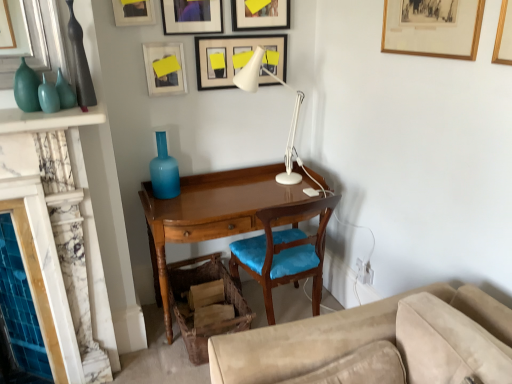
Question: Is wooden swivel chair at lower center aimed at wooden framed picture at upper right, the first picture frame viewed from the right?

Choices:
 (A) no
 (B) yes

Answer: (A)

Question: Does wooden swivel chair at lower center come in front of wooden framed picture at upper right, positioned as the 6th picture frame in left-to-right order?

Choices:
 (A) yes
 (B) no

Answer: (B)

Question: Does wooden swivel chair at lower center appear on the left side of wooden framed picture at upper right, positioned as the 6th picture frame in left-to-right order?

Choices:
 (A) no
 (B) yes

Answer: (B)

Question: Are wooden swivel chair at lower center and wooden framed picture at upper right, positioned as the 6th picture frame in left-to-right order, beside each other?

Choices:
 (A) no
 (B) yes

Answer: (A)

Question: Considering the relative sizes of wooden swivel chair at lower center and wooden framed picture at upper right, positioned as the 6th picture frame in left-to-right order, in the image provided, is wooden swivel chair at lower center bigger than wooden framed picture at upper right, positioned as the 6th picture frame in left-to-right order,?

Choices:
 (A) yes
 (B) no

Answer: (A)

Question: Visually, is matte black picture frame at upper center, which is the fourth picture frame in right-to-left order, positioned to the left or to the right of matte blue glass vase at center, arranged as the first glass vase when viewed from the right?

Choices:
 (A) left
 (B) right

Answer: (B)

Question: From a real-world perspective, is matte black picture frame at upper center, the 3th picture frame positioned from the left, physically located above or below matte blue glass vase at center, arranged as the first glass vase when viewed from the right?

Choices:
 (A) below
 (B) above

Answer: (B)

Question: Based on their sizes in the image, would you say matte black picture frame at upper center, the 3th picture frame positioned from the left, is bigger or smaller than matte blue glass vase at center, arranged as the first glass vase when viewed from the right?

Choices:
 (A) small
 (B) big

Answer: (A)

Question: Relative to matte blue glass vase at center, which is the third glass vase in left-to-right order, is matte black picture frame at upper center, which is the fourth picture frame in right-to-left order, in front or behind?

Choices:
 (A) front
 (B) behind

Answer: (A)

Question: From the image's perspective, is white matte picture frame at upper center, marked as the 2th picture frame in a left-to-right arrangement, above or below wooden chair with blue cushion at center?

Choices:
 (A) below
 (B) above

Answer: (B)

Question: Would you say white matte picture frame at upper center, marked as the 2th picture frame in a left-to-right arrangement, is inside or outside wooden chair with blue cushion at center?

Choices:
 (A) outside
 (B) inside

Answer: (A)

Question: Relative to wooden chair with blue cushion at center, is white matte picture frame at upper center, marked as the 2th picture frame in a left-to-right arrangement, in front or behind?

Choices:
 (A) front
 (B) behind

Answer: (B)

Question: From a real-world perspective, relative to wooden chair with blue cushion at center, is white matte picture frame at upper center, marked as the 2th picture frame in a left-to-right arrangement, vertically above or below?

Choices:
 (A) below
 (B) above

Answer: (B)

Question: From a real-world perspective, is matte teal glass vase at upper left, placed as the 3th glass vase when sorted from right to left, physically located above or below wooden chair with blue cushion at center?

Choices:
 (A) above
 (B) below

Answer: (A)

Question: In terms of width, does matte teal glass vase at upper left, placed as the 3th glass vase when sorted from right to left, look wider or thinner when compared to wooden chair with blue cushion at center?

Choices:
 (A) wide
 (B) thin

Answer: (B)